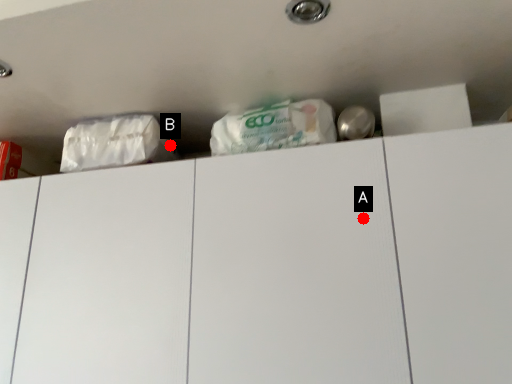
Question: Two points are circled on the image, labeled by A and B beside each circle. Which of the following is the closest to the observer?

Choices:
 (A) A is closer
 (B) B is closer

Answer: (A)